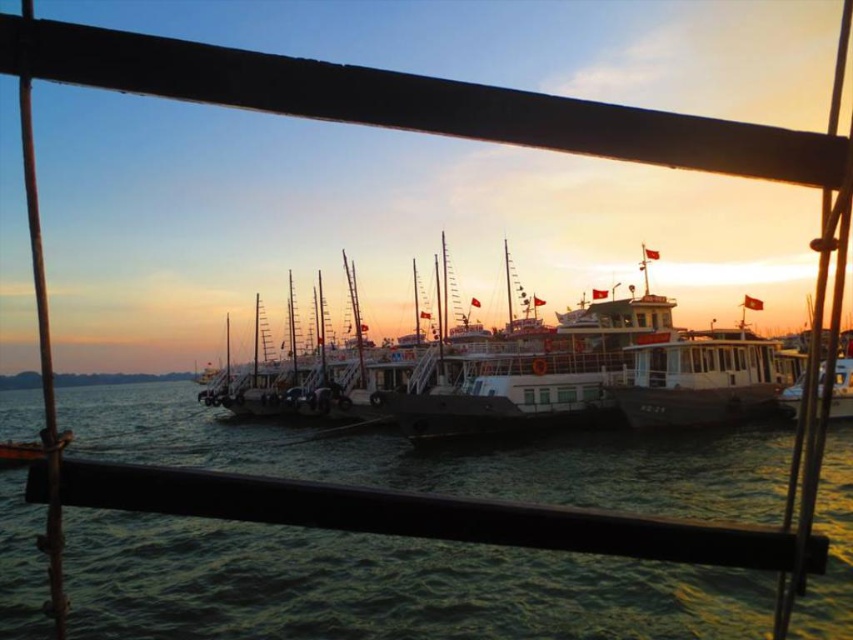
You are standing on the wooden railing and looking at the green water at center and the white matte boat at center. Which object is closer to you?

The white matte boat at center is closer to you because it is positioned above the green water at center.

Consider the image. You are standing on the wooden railing in the foreground of the harbor scene. You see the green water at center and the white matte boat at center. Which object is located to the right side?

The white matte boat at center is located to the right of the green water at center.